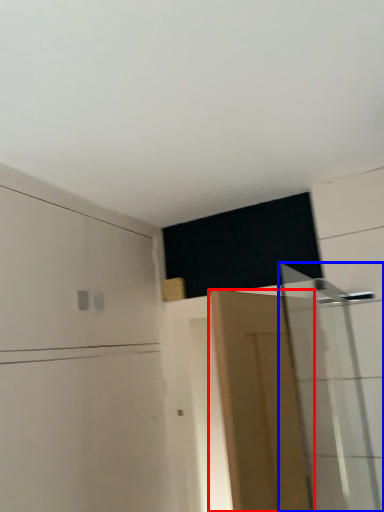
Question: Among these objects, which one is farthest to the camera, door (highlighted by a red box) or shower door (highlighted by a blue box)?

Choices:
 (A) door
 (B) shower door

Answer: (B)